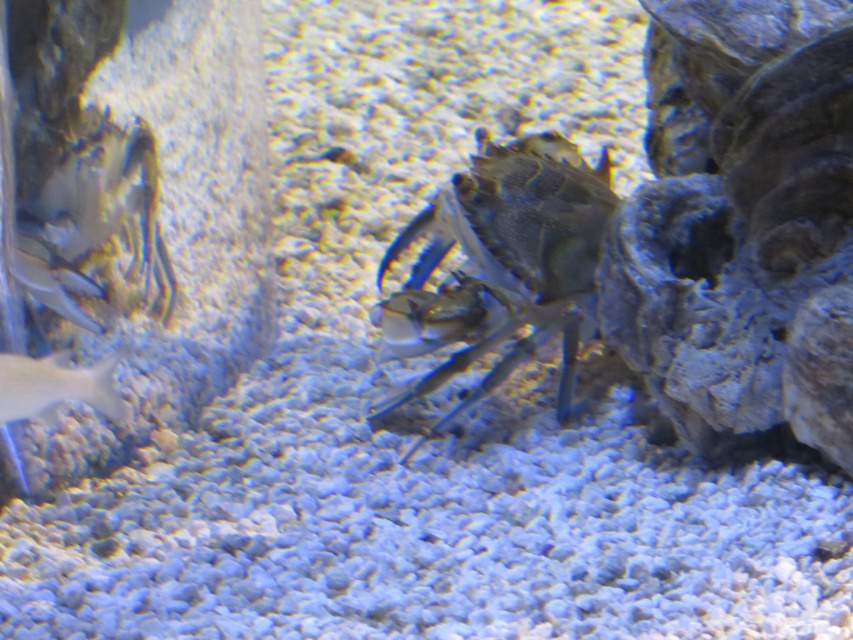
You are an underwater explorer observing the aquarium. You notice the shiny metallic crab at center and the shiny silver fish at lower left. Which object is bigger in size?

The shiny metallic crab at center is larger in size than the shiny silver fish at lower left.

You are an underwater explorer trying to locate the shiny metallic crab at center in an aquarium. According to the coordinates provided, where would you find it?

The shiny metallic crab at center is located at coordinates point (502, 266).

You are a marine biologist observing the underwater scene. You need to capture a closeup photo of the shiny metallic crab at center. The camera you have can focus clearly on objects within 1.5 meters. Will the crab be in focus?

The shiny metallic crab at center is 2.00 meters from the camera, which is beyond the camera focus range of 1.5 meters. Therefore, the crab will not be in focus.